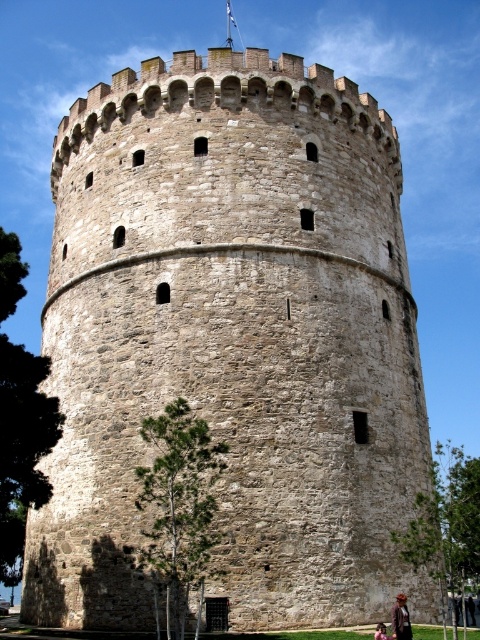
Question: Is brown leather jacket at lower right thinner than brown leather jacket at lower center?

Choices:
 (A) yes
 (B) no

Answer: (B)

Question: Which point is closer to the camera taking this photo?

Choices:
 (A) (399, 624)
 (B) (379, 625)

Answer: (A)

Question: Does brown leather jacket at lower right appear over brown leather jacket at lower center?

Choices:
 (A) no
 (B) yes

Answer: (B)

Question: Is brown leather jacket at lower right to the right of brown leather jacket at lower center from the viewer's perspective?

Choices:
 (A) yes
 (B) no

Answer: (A)